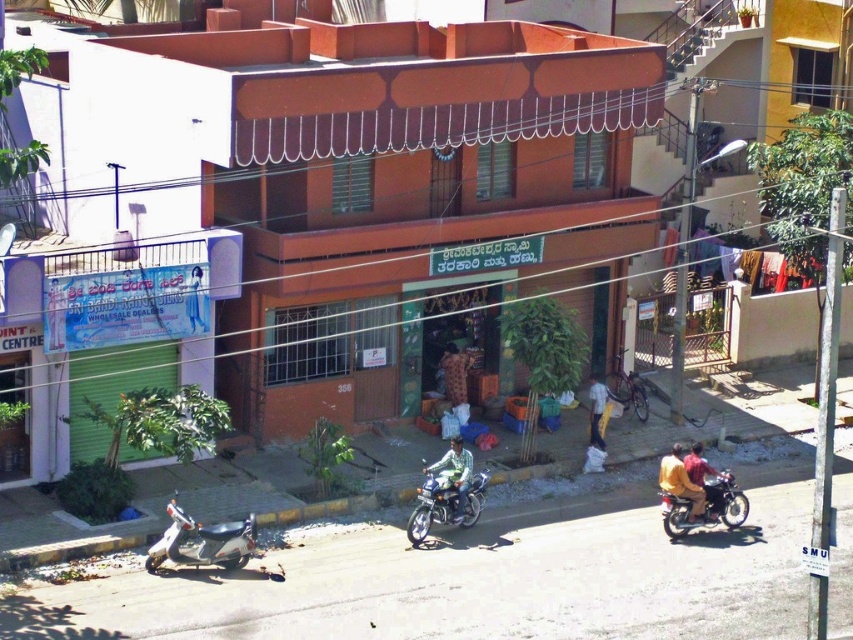
Based on the photo, does shiny black motorcycle at lower right appear on the left side of green matte shirt at center?

No, shiny black motorcycle at lower right is not to the left of green matte shirt at center.

Consider the image. Which of these two, shiny black motorcycle at lower right or green matte shirt at center, stands shorter?

Standing shorter between the two is shiny black motorcycle at lower right.

The image size is (853, 640). What do you see at coordinates (705, 508) in the screenshot?
I see `shiny black motorcycle at lower right` at bounding box center [705, 508].

Identify the location of shiny black motorcycle at lower right. (705, 508).

Which is more to the right, shiny black motorcycle at lower right or yellow fabric at lower right?

shiny black motorcycle at lower right is more to the right.

Between point (730, 500) and point (592, 387), which one is positioned behind?

The point (592, 387) is more distant.

Who is more distant from viewer, (x=689, y=513) or (x=602, y=384)?

Positioned behind is point (x=602, y=384).

What are the coordinates of `shiny black motorcycle at lower right` in the screenshot? It's located at (705, 508).

Can you confirm if shiny metallic motorcycle at center is positioned to the left of yellow fabric at lower right?

Indeed, shiny metallic motorcycle at center is positioned on the left side of yellow fabric at lower right.

Who is more forward, (467, 486) or (596, 429)?

Point (467, 486) is in front.

Which is behind, point (447, 490) or point (592, 416)?

The point (592, 416) is more distant.

You are a GUI agent. You are given a task and a screenshot of the screen. Output one action in this format:
    pyautogui.click(x=<x>, y=<y>)
    Task: Click on the shiny metallic motorcycle at center
    This screenshot has height=640, width=853.
    Given the screenshot: What is the action you would take?
    pyautogui.click(x=445, y=500)